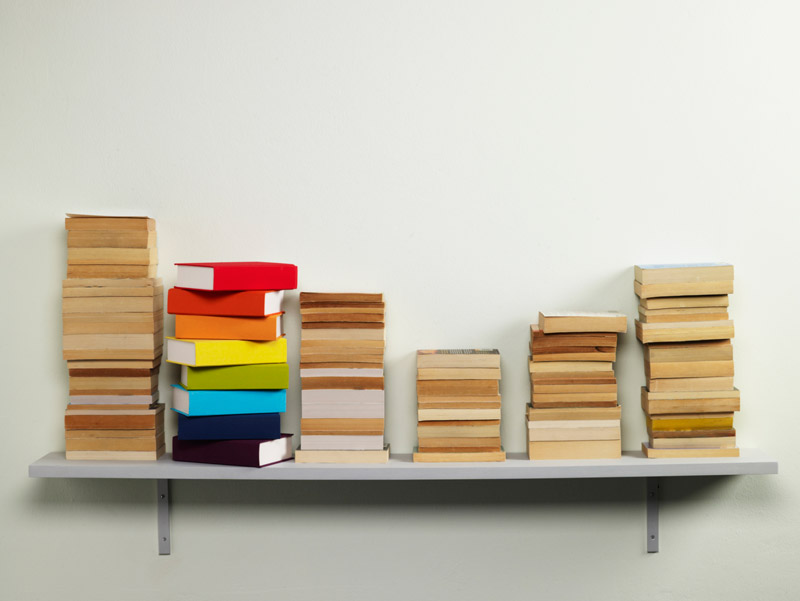
At what (x,y) coordinates should I click in order to perform the action: click on stacks of books where you can see the spine. Please return your answer as a coordinate pair (x, y). This screenshot has height=601, width=800. Looking at the image, I should click on click(x=232, y=460), click(x=238, y=433), click(x=246, y=406), click(x=249, y=382), click(x=244, y=355), click(x=258, y=332), click(x=252, y=308), click(x=248, y=275).